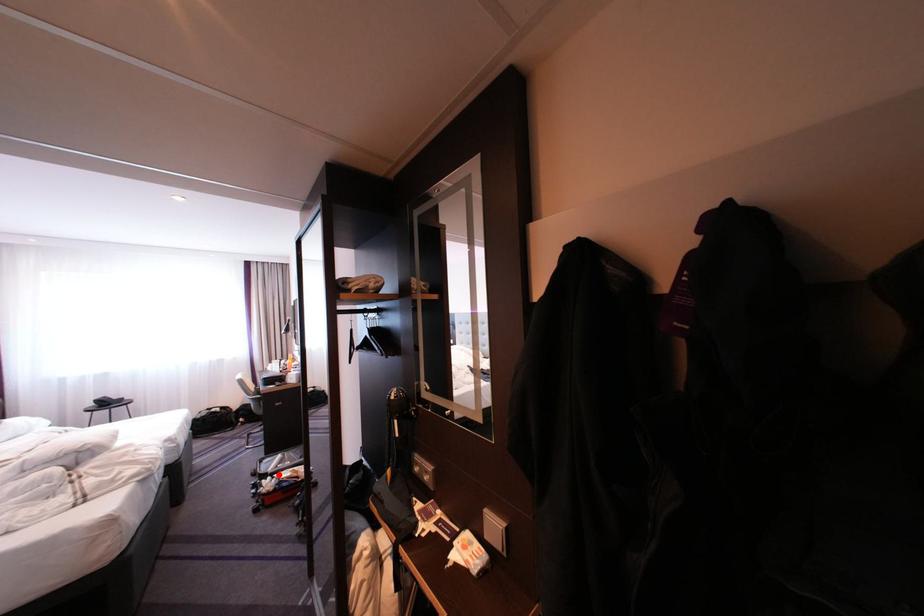
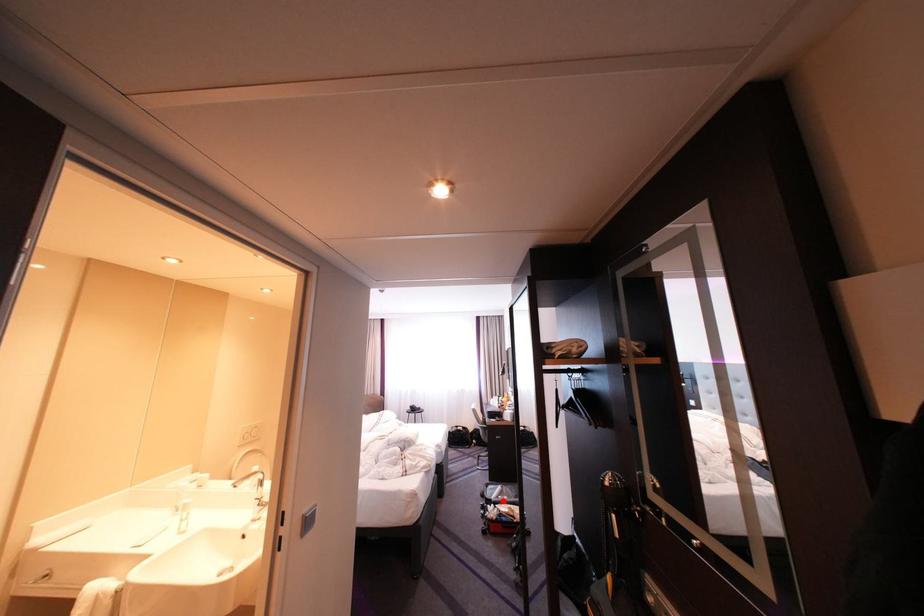
I am providing you with two images of the same scene from different viewpoints. A red point is marked on the first image and another point is marked on the second image. Does the point marked in image1 correspond to the same location as the one in image2?

Yes